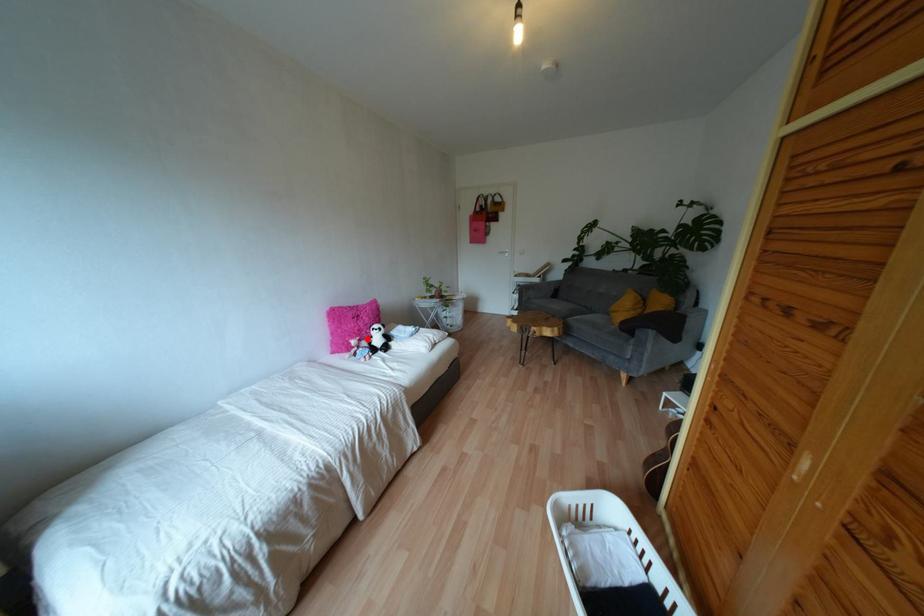
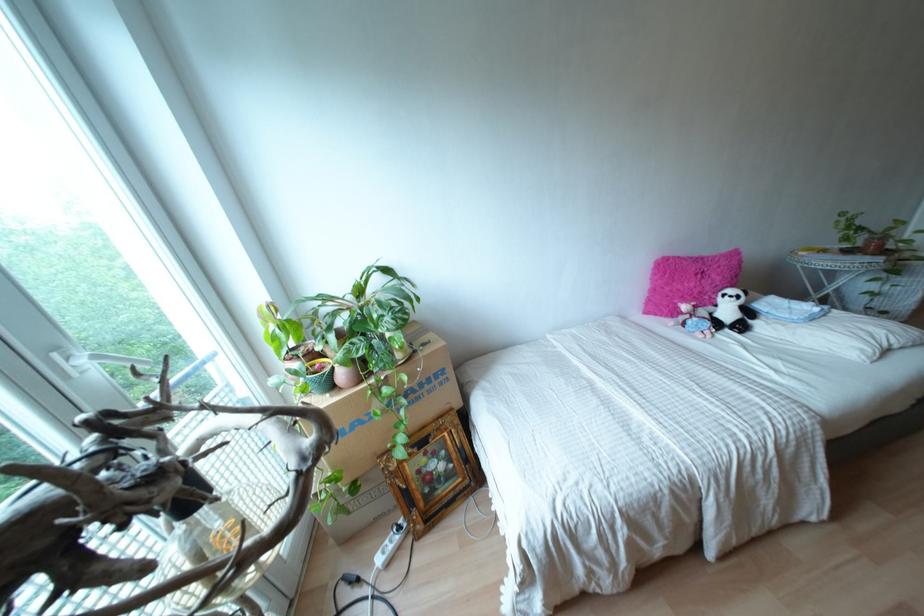
Locate, in the second image, the point that corresponds to the highlighted location in the first image.

(710, 308)